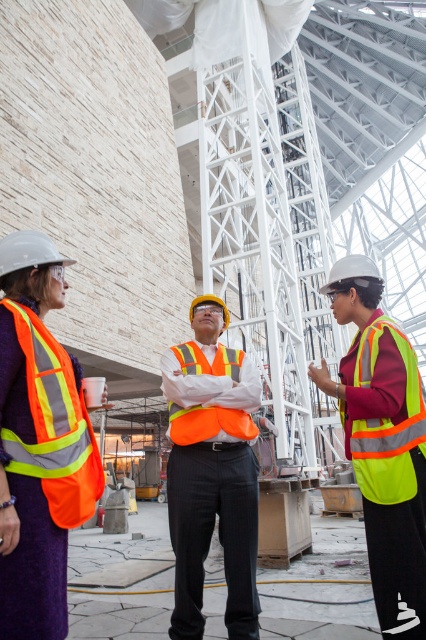
What object is located at the coordinate point (382,444) in the image?

The point (382,444) indicates the location of the high visibility reflective vest at center.